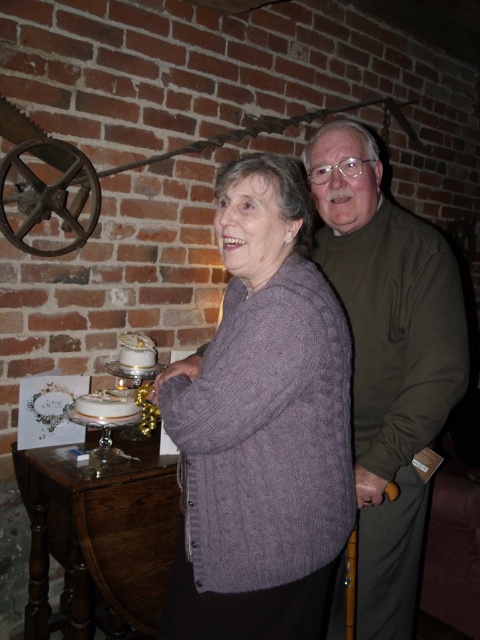
Question: Which point appears closest to the camera in this image?

Choices:
 (A) (121, 394)
 (B) (354, 508)
 (C) (425, 496)

Answer: (B)

Question: Which of these objects is positioned farthest from the white frosted cake at center?

Choices:
 (A) white glossy cake at lower left
 (B) olive green sweater at center

Answer: (B)

Question: Does white glossy cake at lower left come behind white frosted cake at center?

Choices:
 (A) yes
 (B) no

Answer: (B)

Question: Among these points, which one is farthest from the camera?

Choices:
 (A) (123, 422)
 (B) (276, 628)
 (C) (371, 532)

Answer: (A)

Question: Is purple knitted sweater at center behind olive green sweater at center?

Choices:
 (A) yes
 (B) no

Answer: (B)

Question: Does white glossy cake at lower left have a greater width compared to white frosted cake at center?

Choices:
 (A) no
 (B) yes

Answer: (B)